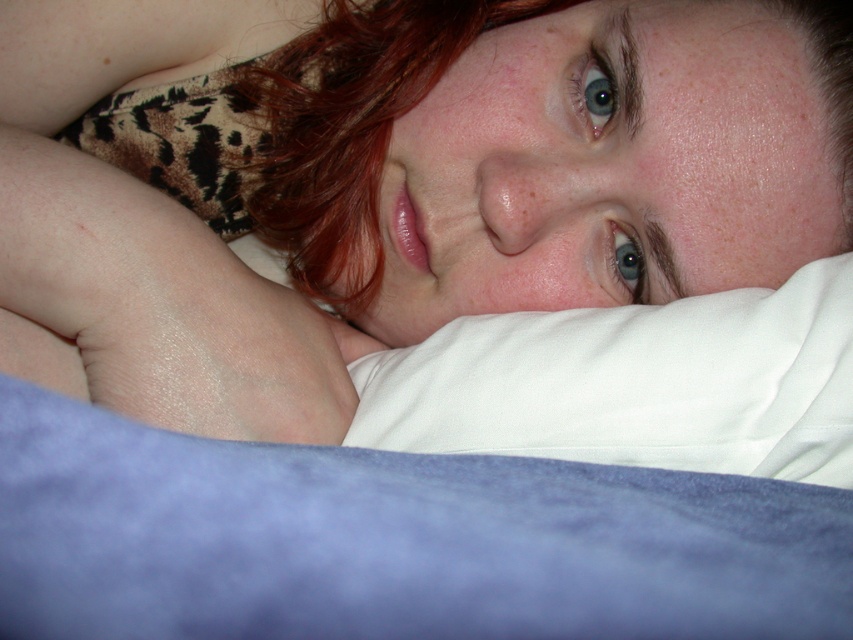
Question: Can you confirm if blue velvety sheet at lower center is bigger than white soft pillow at center?

Choices:
 (A) no
 (B) yes

Answer: (A)

Question: Is matte white pillow at upper center to the right of white soft pillow at center from the viewer's perspective?

Choices:
 (A) yes
 (B) no

Answer: (B)

Question: Which object appears farthest from the camera in this image?

Choices:
 (A) white soft pillow at center
 (B) matte white pillow at upper center

Answer: (B)

Question: Which object is farther from the camera taking this photo?

Choices:
 (A) blue velvety sheet at lower center
 (B) white soft pillow at center
 (C) matte white pillow at upper center

Answer: (C)

Question: Which object is positioned farthest from the blue velvety sheet at lower center?

Choices:
 (A) matte white pillow at upper center
 (B) white soft pillow at center

Answer: (A)

Question: From the image, what is the correct spatial relationship of blue velvety sheet at lower center in relation to white soft pillow at center?

Choices:
 (A) right
 (B) left

Answer: (B)